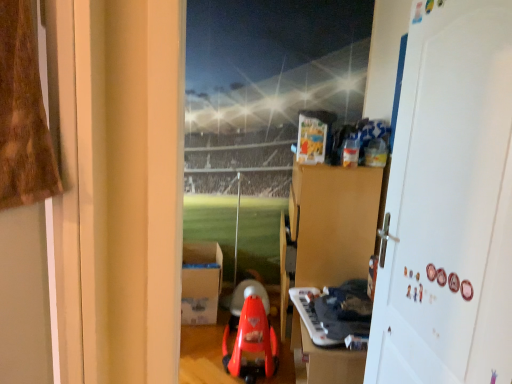
Question: Is brown cardboard dresser at upper center completely or partially outside of white matte door at right?

Choices:
 (A) no
 (B) yes

Answer: (B)

Question: Does brown cardboard dresser at upper center appear on the right side of white matte door at right?

Choices:
 (A) yes
 (B) no

Answer: (B)

Question: Is brown cardboard dresser at upper center oriented towards white matte door at right?

Choices:
 (A) yes
 (B) no

Answer: (B)

Question: From the image's perspective, is brown cardboard dresser at upper center above white matte door at right?

Choices:
 (A) yes
 (B) no

Answer: (B)

Question: From the image's perspective, would you say brown cardboard dresser at upper center is shown under white matte door at right?

Choices:
 (A) no
 (B) yes

Answer: (B)

Question: Is the depth of brown cardboard dresser at upper center less than that of white matte door at right?

Choices:
 (A) no
 (B) yes

Answer: (A)

Question: Does white cardboard box at center have a smaller size compared to white matte door at right?

Choices:
 (A) yes
 (B) no

Answer: (B)

Question: Would you consider white cardboard box at center to be distant from white matte door at right?

Choices:
 (A) no
 (B) yes

Answer: (B)

Question: Does white cardboard box at center have a greater height compared to white matte door at right?

Choices:
 (A) no
 (B) yes

Answer: (A)

Question: Can you confirm if white cardboard box at center is shorter than white matte door at right?

Choices:
 (A) no
 (B) yes

Answer: (B)

Question: Does white cardboard box at center have a larger size compared to white matte door at right?

Choices:
 (A) yes
 (B) no

Answer: (A)

Question: Is white cardboard box at center closer to camera compared to white matte door at right?

Choices:
 (A) no
 (B) yes

Answer: (A)

Question: Is white cardboard box at center located outside brown cardboard dresser at upper center?

Choices:
 (A) no
 (B) yes

Answer: (B)